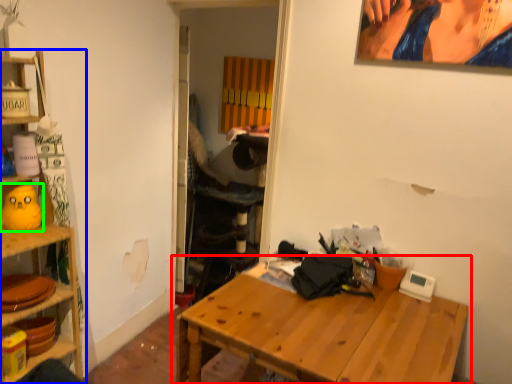
Question: Which object is positioned closest to table (highlighted by a red box)? Select from shelf (highlighted by a blue box) and toy (highlighted by a green box).

Choices:
 (A) shelf
 (B) toy

Answer: (A)